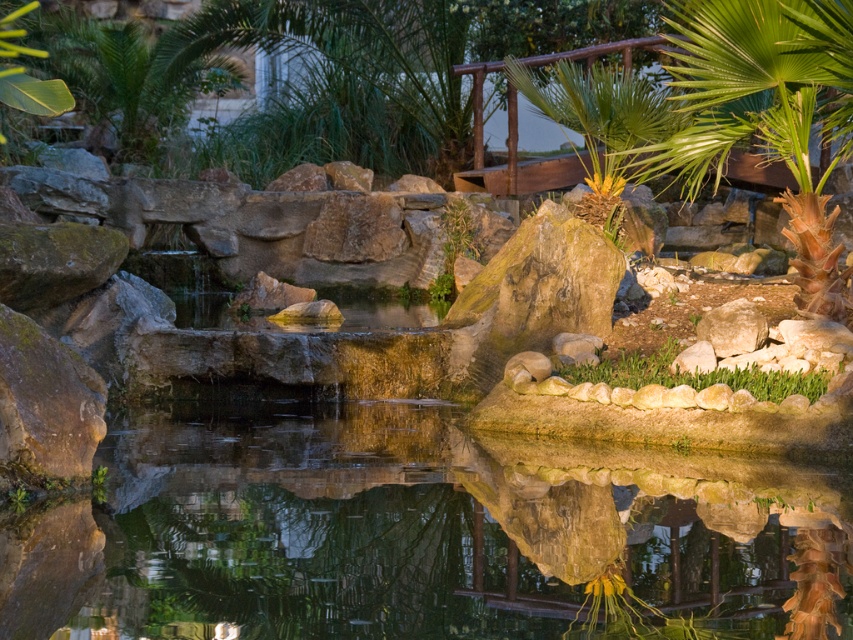
Does green leafy palm tree at center have a lesser height compared to brown rough rock at center-right?

No, green leafy palm tree at center is not shorter than brown rough rock at center-right.

Is green leafy palm tree at center to the left of brown rough rock at center-right from the viewer's perspective?

Indeed, green leafy palm tree at center is positioned on the left side of brown rough rock at center-right.

Between point (587, 180) and point (723, 312), which one is positioned in front?

Point (723, 312)

This screenshot has height=640, width=853. Identify the location of green leafy palm tree at center. (601, 128).

Can you confirm if green leafy palm tree at upper right is thinner than green grass at center?

In fact, green leafy palm tree at upper right might be wider than green grass at center.

Looking at this image, does green leafy palm tree at upper right appear over green grass at center?

Correct, green leafy palm tree at upper right is located above green grass at center.

Does point (839, 92) come behind point (648, 378)?

Yes, point (839, 92) is behind point (648, 378).

The width and height of the screenshot is (853, 640). In order to click on green leafy palm tree at upper right in this screenshot , I will do `click(766, 113)`.

Between green leafy palm tree at upper left and green grass at center, which one has more height?

green leafy palm tree at upper left is taller.

This screenshot has width=853, height=640. Describe the element at coordinates (132, 83) in the screenshot. I see `green leafy palm tree at upper left` at that location.

You are a GUI agent. You are given a task and a screenshot of the screen. Output one action in this format:
    pyautogui.click(x=<x>, y=<y>)
    Task: Click on the green leafy palm tree at upper left
    
    Given the screenshot: What is the action you would take?
    pyautogui.click(x=132, y=83)

Identify the location of green leafy palm tree at upper left. Image resolution: width=853 pixels, height=640 pixels. pyautogui.click(x=132, y=83).